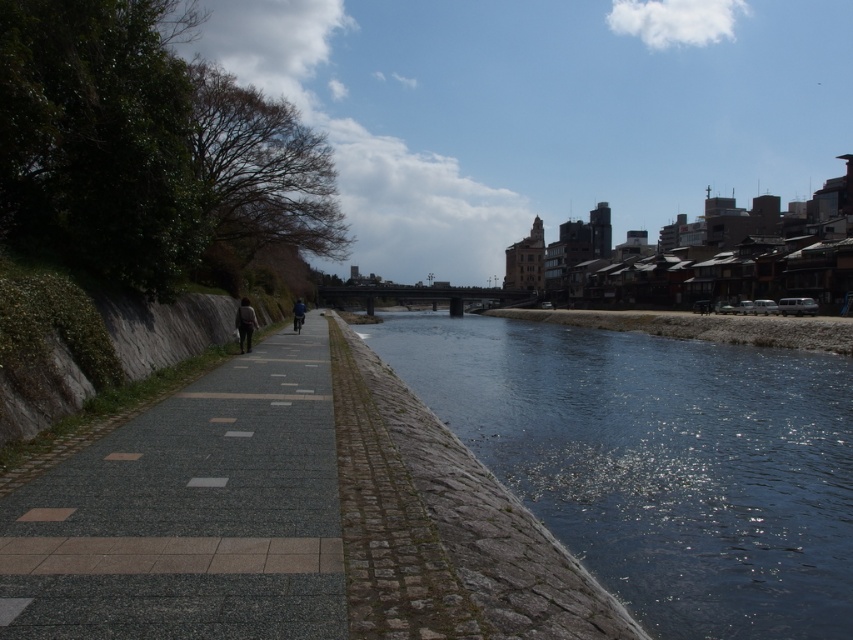
Question: Considering the relative positions of gray cobblestone sidewalk at center and dark gray fabric jacket at center in the image provided, where is gray cobblestone sidewalk at center located with respect to dark gray fabric jacket at center?

Choices:
 (A) above
 (B) below

Answer: (B)

Question: Considering the relative positions of dark gray fabric jacket at center and blue fabric jacket at center in the image provided, where is dark gray fabric jacket at center located with respect to blue fabric jacket at center?

Choices:
 (A) left
 (B) right

Answer: (B)

Question: Considering the real-world distances, which object is farthest from the dark blue water at center?

Choices:
 (A) blue fabric jacket at center
 (B) dark gray fabric jacket at center

Answer: (B)

Question: Is dark blue water at center wider than blue fabric jacket at center?

Choices:
 (A) yes
 (B) no

Answer: (A)

Question: Among these objects, which one is nearest to the camera?

Choices:
 (A) gray cobblestone sidewalk at center
 (B) blue fabric jacket at center
 (C) dark gray fabric jacket at center

Answer: (A)

Question: Which point is closer to the camera taking this photo?

Choices:
 (A) (469, 424)
 (B) (300, 304)
 (C) (242, 307)

Answer: (A)